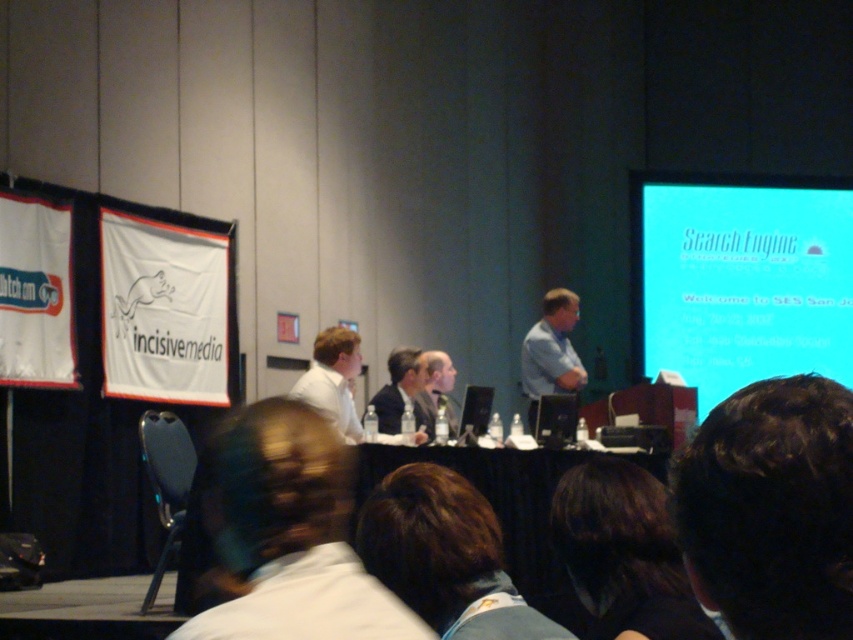
Question: Is dark brown hair at upper right positioned at the back of light brown suit at center?

Choices:
 (A) no
 (B) yes

Answer: (A)

Question: Which point is closer to the camera?

Choices:
 (A) blue glossy projection screen at upper right
 (B) black fabric table at center

Answer: (B)

Question: Can you confirm if blue shirt at center is positioned to the left of white matte shirt at center?

Choices:
 (A) yes
 (B) no

Answer: (B)

Question: Is the position of blue shirt at center more distant than that of dark suit at center?

Choices:
 (A) yes
 (B) no

Answer: (A)

Question: Among these objects, which one is farthest from the camera?

Choices:
 (A) brown hair at lower center
 (B) blue glossy projection screen at upper right
 (C) blue shirt at center

Answer: (B)

Question: Among these points, which one is nearest to the camera?

Choices:
 (A) (552, 465)
 (B) (419, 611)
 (C) (297, 385)
 (D) (387, 401)

Answer: (B)